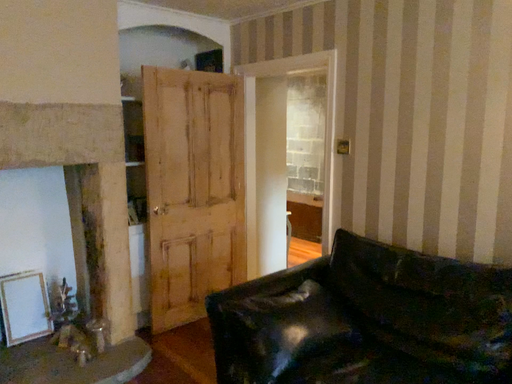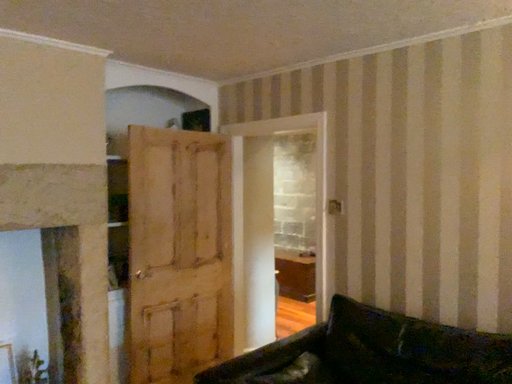
Question: How did the camera likely rotate when shooting the video?

Choices:
 (A) rotated upward
 (B) rotated downward

Answer: (A)